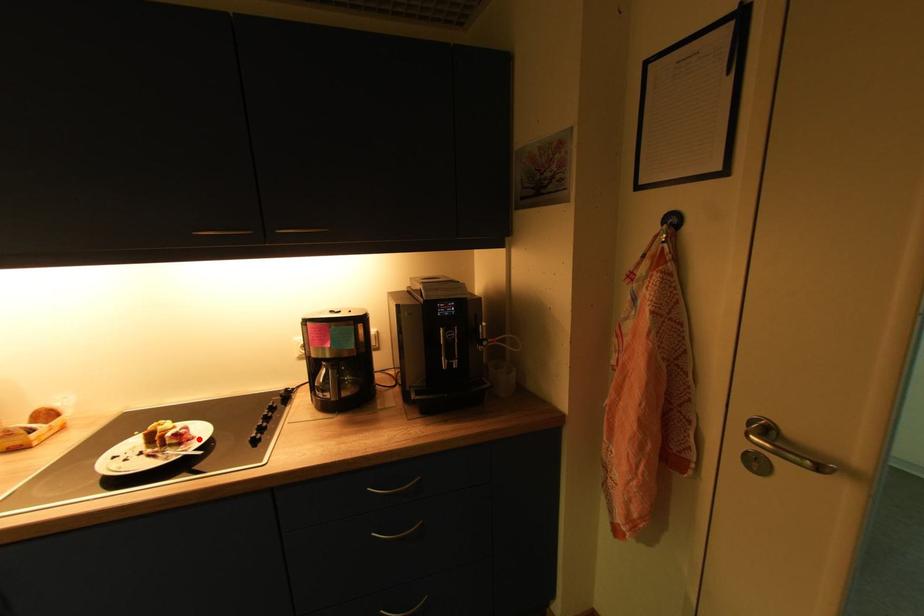
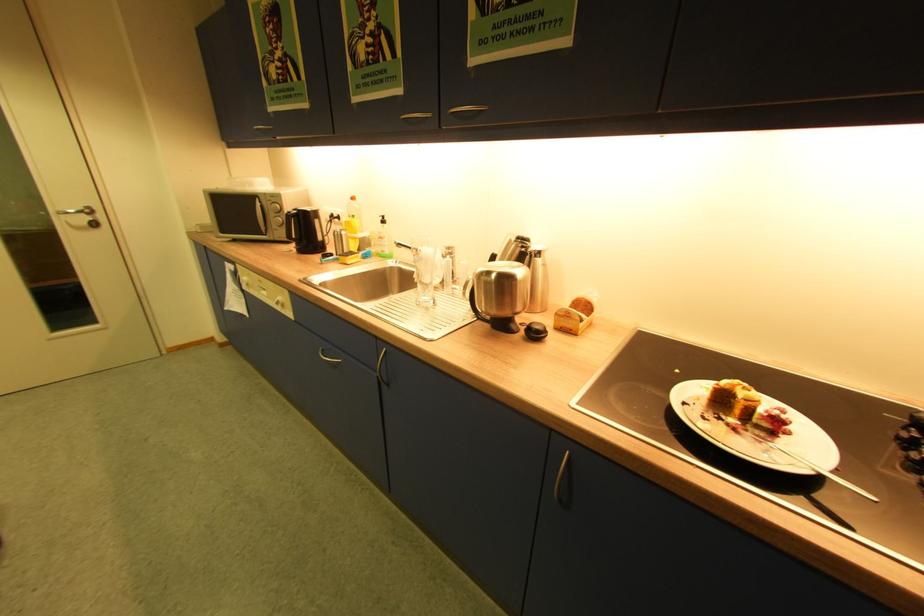
Question: I am providing you with two images of the same scene from different viewpoints. A red point is marked on the first image. Is the red point's position out of view in image 2?

Choices:
 (A) Yes
 (B) No

Answer: (B)